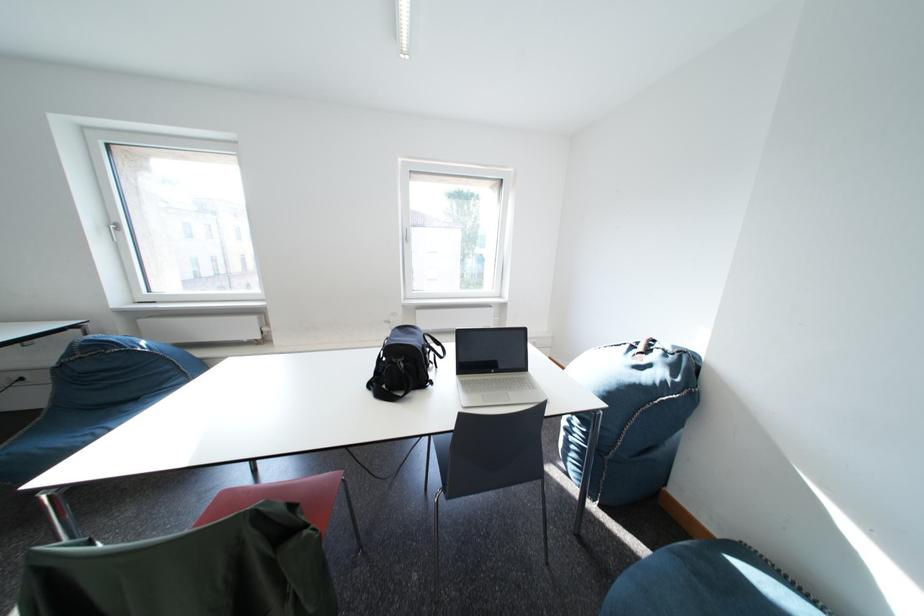
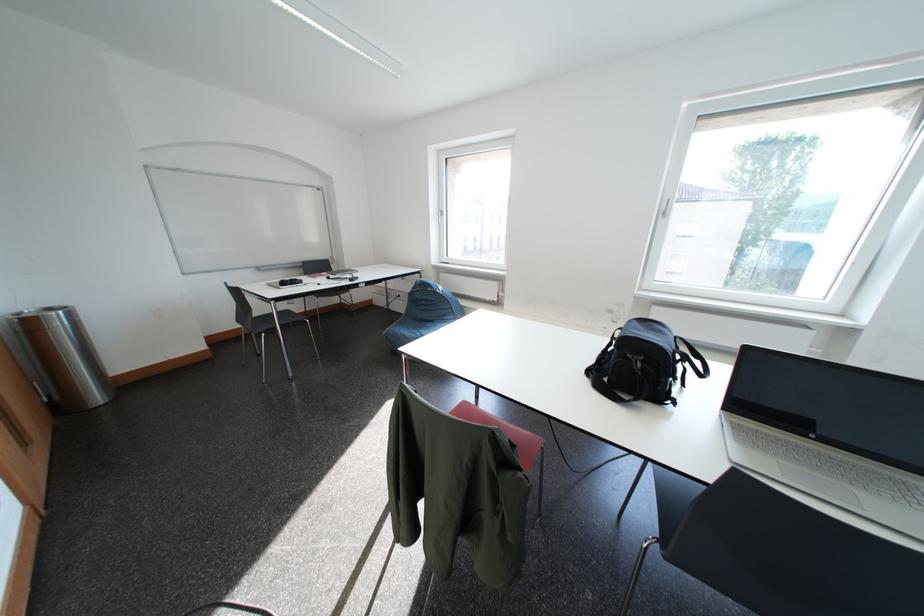
In the second image, find the point that corresponds to the point at 475,387 in the first image.

(747, 431)